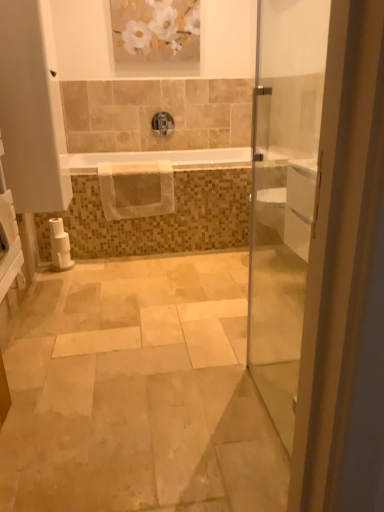
I want to click on vacant space in front of white matte toilet paper at lower left, so click(x=65, y=274).